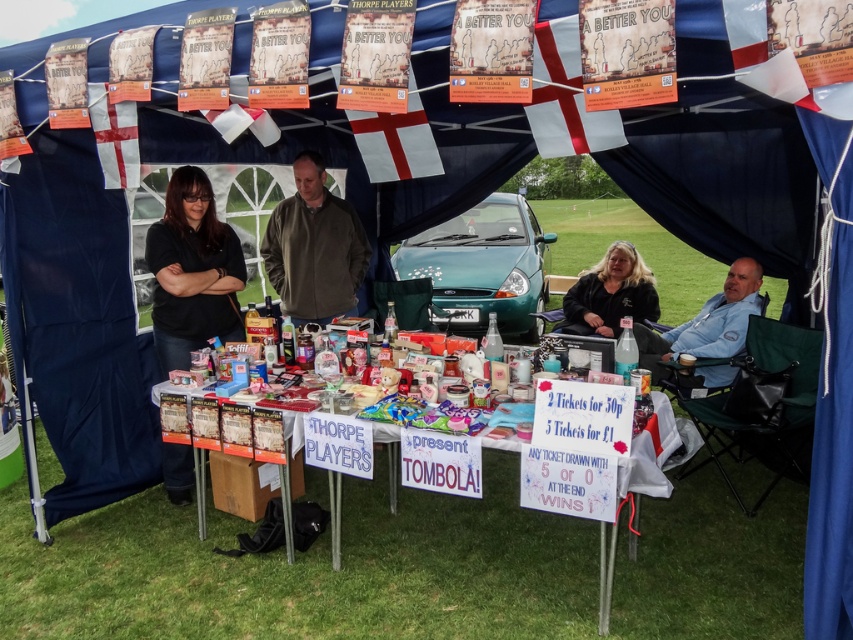
You are standing at the entrance of the tent and want to pick up an item from the table. There are two points marked on the table where items are placed. Which point is closer to you, point [323,205] or point [645,282]?

Point [323,205] is closer to the camera than point [645,282], so you can reach it more easily.